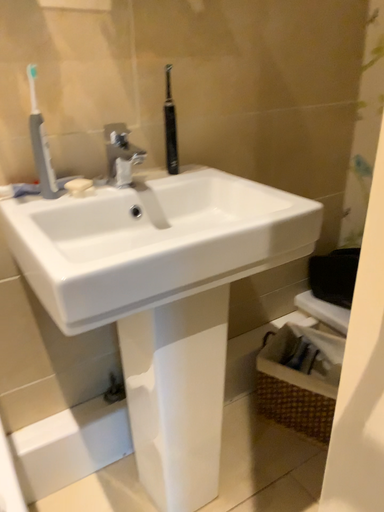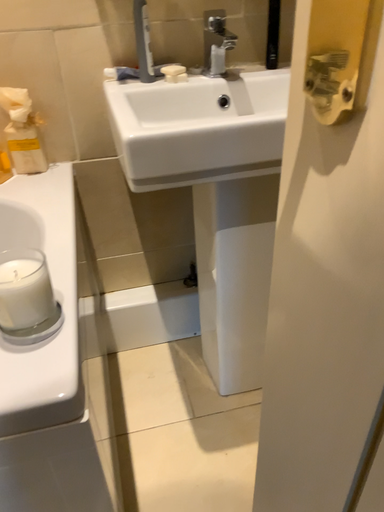
Question: Which way did the camera rotate in the video?

Choices:
 (A) rotated upward
 (B) rotated downward

Answer: (B)